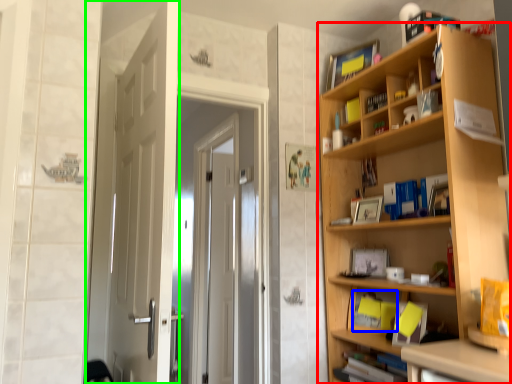
Question: Considering the real-world distances, which object is closest to bookcase (highlighted by a red box)? book (highlighted by a blue box) or door (highlighted by a green box).

Choices:
 (A) book
 (B) door

Answer: (A)